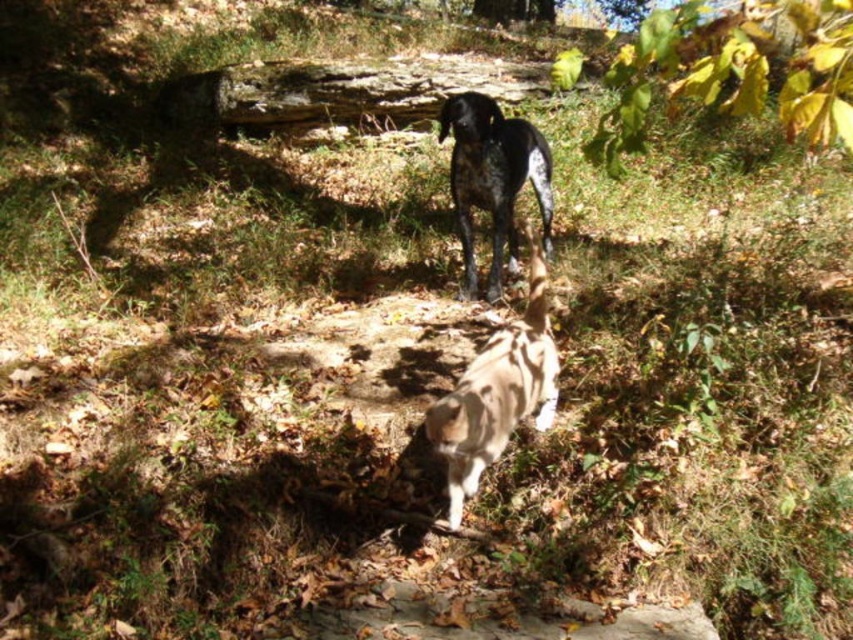
You are standing in the forest and see two points marked in the scene. Which point is closer to you, point [430,406] or point [474,104]?

Point [430,406] is closer to the viewer than point [474,104].

You are standing in the forest and see the spotted fur dog at center. If you want to take a photo of it, where should you position yourself relative to the dog to ensure it is centered in your camera frame?

To center the spotted fur dog at center in your camera frame, position yourself directly in front of it at the coordinates corresponding to its location at point (497, 392).

You are a photographer trying to capture both the spotted fur dog at center and the speckled fur dog at upper center in a single photo. Based on their sizes in the image, which dog will appear smaller in the final photograph?

The spotted fur dog at center will appear smaller in the final photograph because it occupies less space than the speckled fur dog at upper center.